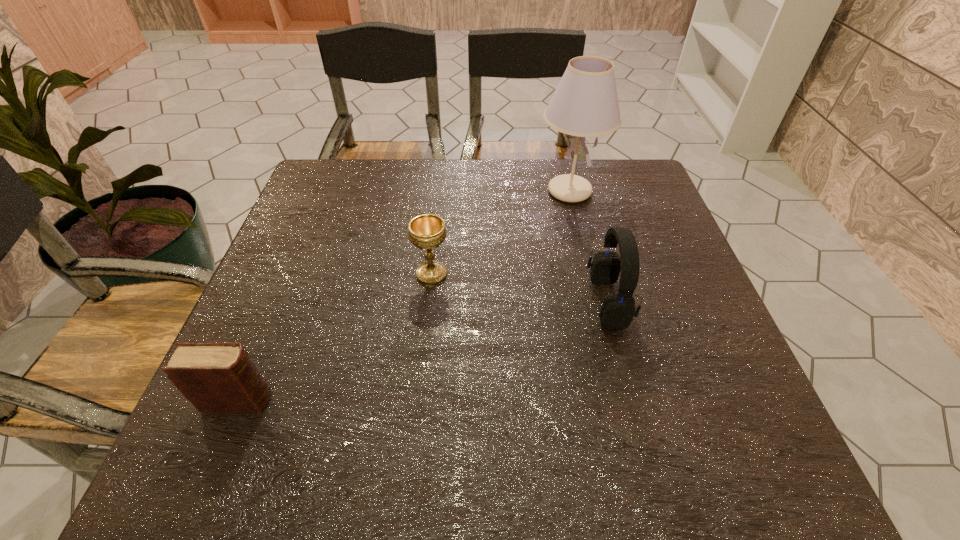
In the image, there is a desktop. Where is `vacant space at the far left corner`? vacant space at the far left corner is located at coordinates (307, 206).

This screenshot has height=540, width=960. I want to click on vacant space at the near left corner of the desktop, so click(269, 430).

Find the location of a particular element. This screenshot has height=540, width=960. vacant point at the far right corner is located at coordinates (634, 163).

Locate an element on the screen. The width and height of the screenshot is (960, 540). vacant region between the diary and the lampshade is located at coordinates (404, 296).

At what (x,y) coordinates should I click in order to perform the action: click on free space between the diary and the tallest object. Please return your answer as a coordinate pair (x, y). Image resolution: width=960 pixels, height=540 pixels. Looking at the image, I should click on (404, 296).

Locate an element on the screen. Image resolution: width=960 pixels, height=540 pixels. empty space between the diary and the tallest object is located at coordinates (404, 296).

Locate an element on the screen. Image resolution: width=960 pixels, height=540 pixels. free space between the third shortest object and the nearest object is located at coordinates (423, 351).

Where is `vacant space that is in between the diary and the third object from right to left`? vacant space that is in between the diary and the third object from right to left is located at coordinates (335, 338).

At what (x,y) coordinates should I click in order to perform the action: click on free space between the third shortest object and the nearest object. Please return your answer as a coordinate pair (x, y). The width and height of the screenshot is (960, 540). Looking at the image, I should click on (423, 351).

I want to click on vacant point located between the second tallest object and the tallest object, so click(588, 246).